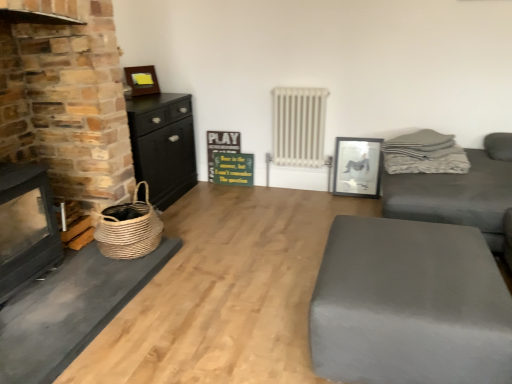
Question: Considering the positions of green wooden signboard at center and black wood chest of drawers at left in the image, is green wooden signboard at center wider or thinner than black wood chest of drawers at left?

Choices:
 (A) wide
 (B) thin

Answer: (B)

Question: From a real-world perspective, is green wooden signboard at center physically located above or below black wood chest of drawers at left?

Choices:
 (A) below
 (B) above

Answer: (A)

Question: Which of these objects is positioned farthest from the green wooden signboard at center?

Choices:
 (A) black wood chest of drawers at left
 (B) gray fabric couch at right
 (C) white metallic radiator at center
 (D) brick fireplace at left
 (E) woven straw basket at left

Answer: (B)

Question: Which is farther from the gray fabric couch at right?

Choices:
 (A) black glossy picture frame at upper right, which is counted as the 1th picture frame, starting from the right
 (B) wooden picture frame at upper left, arranged as the 1th picture frame when viewed from the left
 (C) green wooden signboard at center
 (D) woven straw basket at left
 (E) brick fireplace at left

Answer: (B)